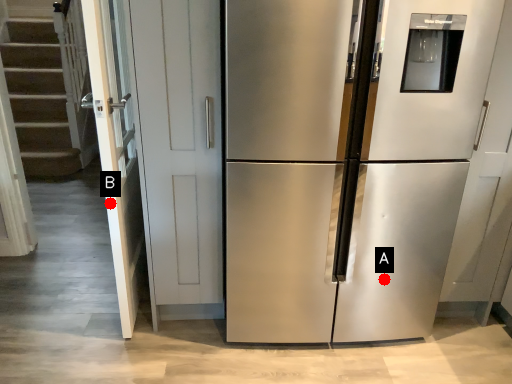
Question: Two points are circled on the image, labeled by A and B beside each circle. Which point is closer to the camera?

Choices:
 (A) A is closer
 (B) B is closer

Answer: (B)